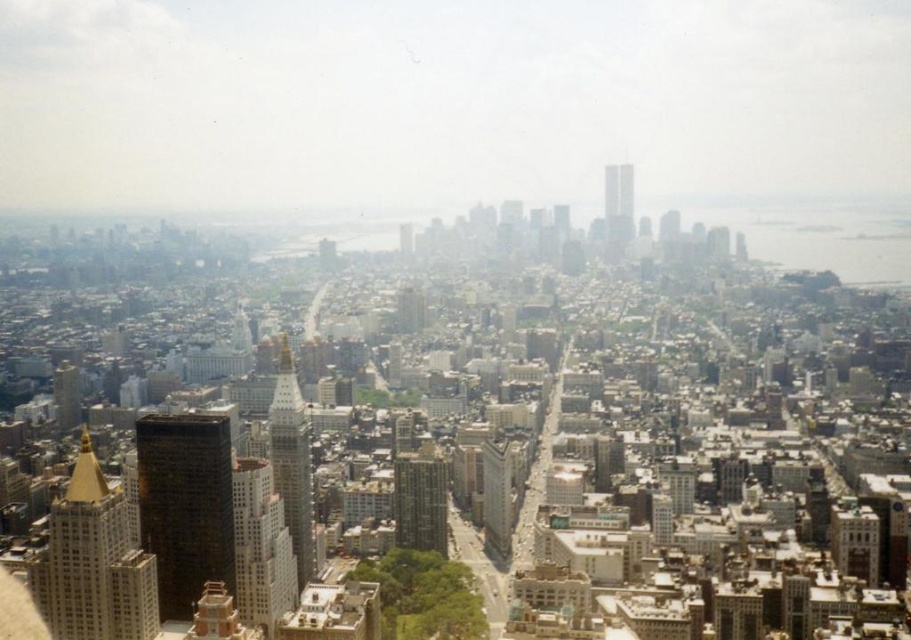
Question: Where is white marble skyscraper at center located in relation to white glass skyscraper at center in the image?

Choices:
 (A) left
 (B) right

Answer: (A)

Question: Which point is farther to the camera?

Choices:
 (A) smooth glass skyscraper at center
 (B) dark brown glass skyscraper at lower left
 (C) white glass skyscraper at center

Answer: (B)

Question: Does white marble skyscraper at center appear on the left side of green glass skyscraper at center?

Choices:
 (A) no
 (B) yes

Answer: (B)

Question: Does dark brown glass skyscraper at lower left have a smaller size compared to smooth glass skyscraper at center?

Choices:
 (A) yes
 (B) no

Answer: (B)

Question: Which object is closer to the camera taking this photo?

Choices:
 (A) smooth glass skyscraper at center
 (B) goldmaterial/texturetower at center
 (C) green glass skyscraper at center
 (D) dark brown glass skyscraper at lower left

Answer: (C)

Question: Among these objects, which one is farthest from the camera?

Choices:
 (A) smooth glass skyscraper at center
 (B) green glass skyscraper at center
 (C) dark brown glass skyscraper at lower left
 (D) goldmaterial/texturetower at center

Answer: (C)